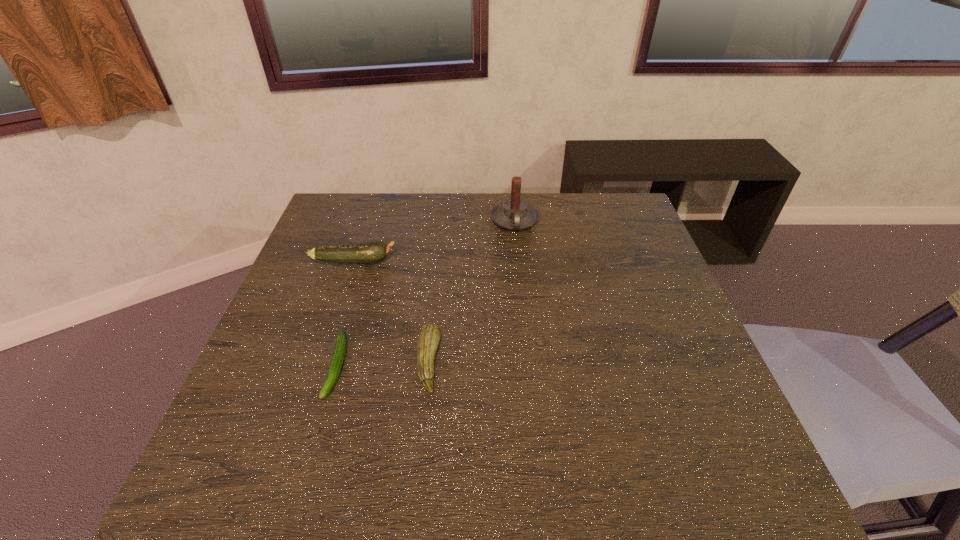
You are a GUI agent. You are given a task and a screenshot of the screen. Output one action in this format:
    pyautogui.click(x=<x>, y=<y>)
    Task: Click on the vacant space located 0.060m on the front-facing side of the shortest zucchini
    The image size is (960, 540).
    Given the screenshot: What is the action you would take?
    pyautogui.click(x=318, y=430)

I want to click on object located at the far edge, so click(514, 214).

Where is `object that is at the left edge`? The height and width of the screenshot is (540, 960). object that is at the left edge is located at coordinates (375, 251).

Identify the location of vacant space at the far edge. The width and height of the screenshot is (960, 540). (401, 210).

The width and height of the screenshot is (960, 540). Find the location of `vacant region at the near edge of the desktop`. vacant region at the near edge of the desktop is located at coordinates (436, 496).

This screenshot has width=960, height=540. Identify the location of free space at the left edge. (276, 417).

In the image, there is a desktop. Where is `vacant space at the right edge`? The width and height of the screenshot is (960, 540). vacant space at the right edge is located at coordinates (619, 292).

Find the location of a particular element. This screenshot has height=540, width=960. vacant space at the far left corner of the desktop is located at coordinates (340, 200).

Image resolution: width=960 pixels, height=540 pixels. Identify the location of vacant space at the near left corner of the desktop. (280, 481).

In the image, there is a desktop. Where is `vacant space at the far right corner`? vacant space at the far right corner is located at coordinates (599, 199).